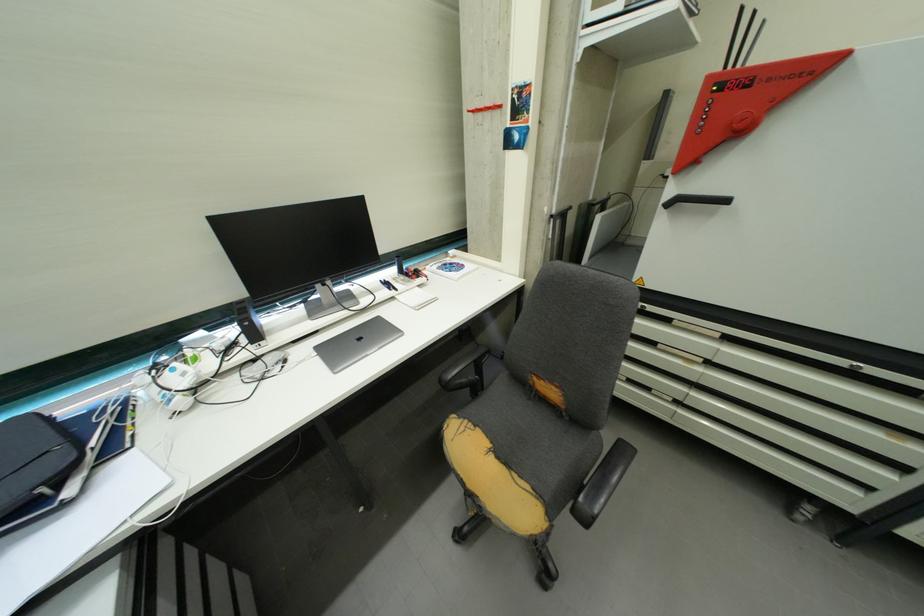
Where would you pull the black machine handle? Please return your answer as a coordinate pair (x, y).

(698, 200)